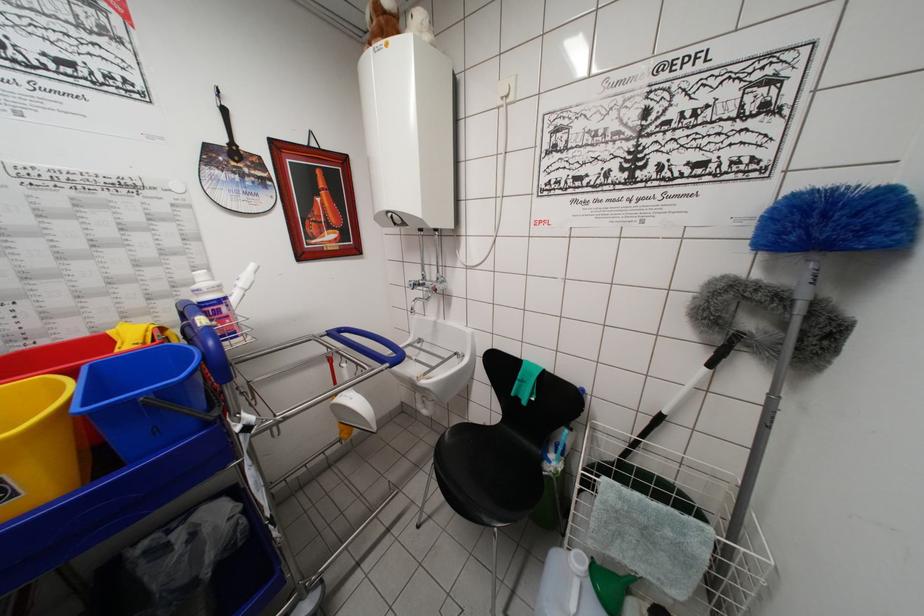
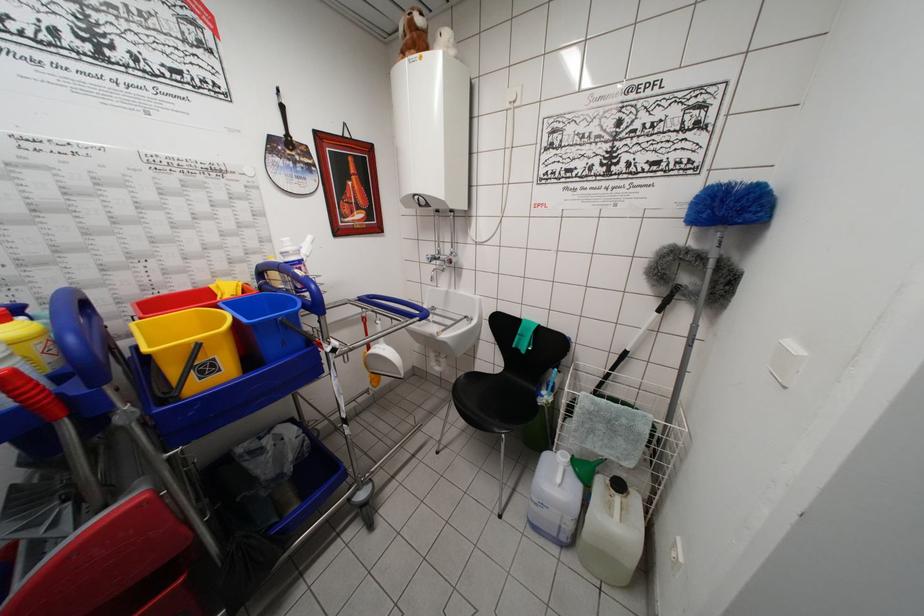
Find the pixel in the second image that matches [821,209] in the first image.

(723, 199)